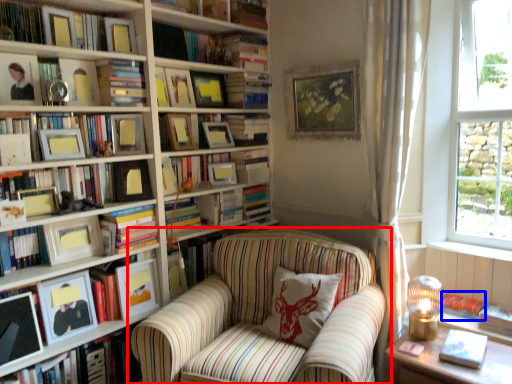
Question: Which point is closer to the camera, chair (highlighted by a red box) or book (highlighted by a blue box)?

Choices:
 (A) chair
 (B) book

Answer: (A)